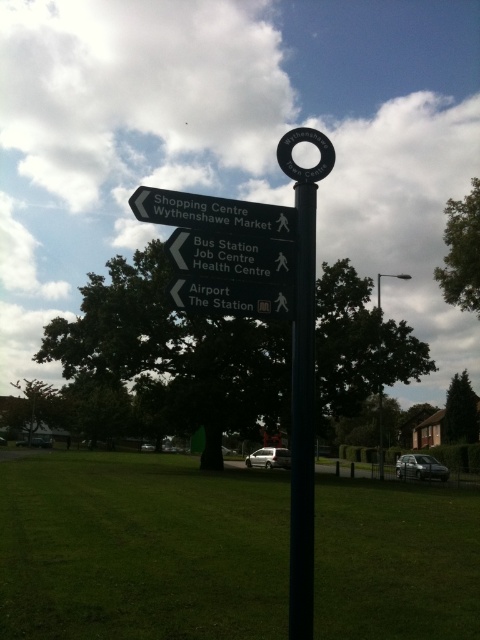
Question: Which object is the farthest from the black metal pole at center?

Choices:
 (A) black plastic sign at upper left
 (B) green grass at center
 (C) black plastic signpost at center

Answer: (B)

Question: Among these objects, which one is farthest from the camera?

Choices:
 (A) white matte car at center
 (B) metallic silver suv at lower right
 (C) black metal pole at center

Answer: (A)

Question: Observing the image, what is the correct spatial positioning of black plastic signpost at center in reference to metallic silver suv at lower right?

Choices:
 (A) right
 (B) left

Answer: (B)

Question: Can you confirm if green grass at center is positioned above white plastic sign at center?

Choices:
 (A) yes
 (B) no

Answer: (B)

Question: Does black plastic sign at upper left lie behind white plastic sign at center?

Choices:
 (A) yes
 (B) no

Answer: (A)

Question: Which point is farther to the camera?

Choices:
 (A) white matte car at center
 (B) white plastic sign at center

Answer: (A)